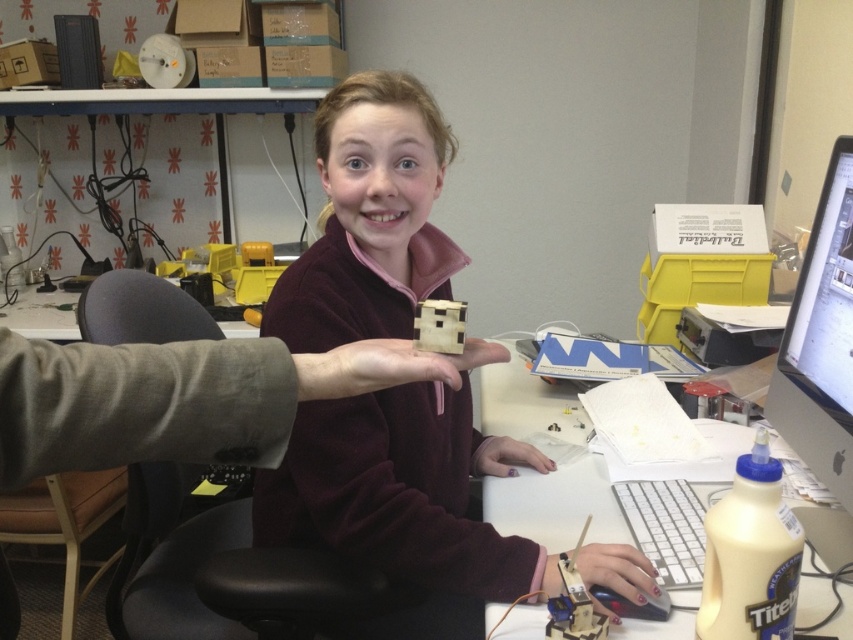
Question: Which point is farther from the camera taking this photo?

Choices:
 (A) (779, 356)
 (B) (451, 554)

Answer: (A)

Question: Can you confirm if wooden block at center is thinner than matte black monitor at right?

Choices:
 (A) yes
 (B) no

Answer: (B)

Question: Which point is farther from the camera taking this photo?

Choices:
 (A) (502, 509)
 (B) (821, 355)

Answer: (A)

Question: Which object appears farthest from the camera in this image?

Choices:
 (A) wooden block at center
 (B) white plastic computer desk at center
 (C) matte black monitor at right

Answer: (C)

Question: Does wooden block at center appear on the right side of matte black monitor at right?

Choices:
 (A) yes
 (B) no

Answer: (B)

Question: Can you confirm if wooden block at center is thinner than white plastic computer desk at center?

Choices:
 (A) no
 (B) yes

Answer: (A)